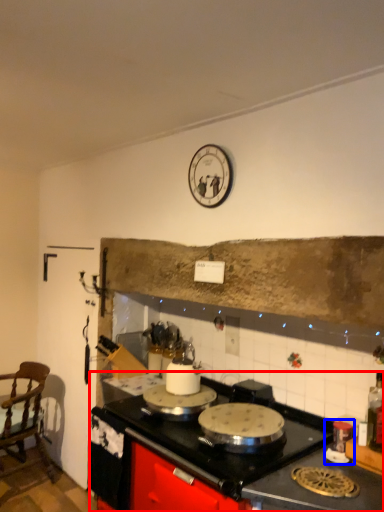
Question: Which object is further to the camera taking this photo, countertop (highlighted by a red box) or appliance (highlighted by a blue box)?

Choices:
 (A) countertop
 (B) appliance

Answer: (B)